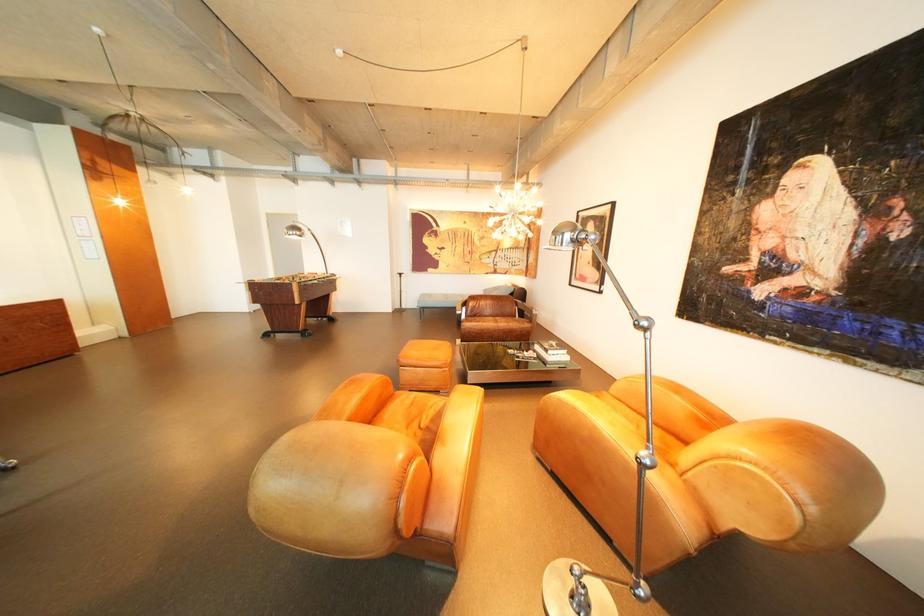
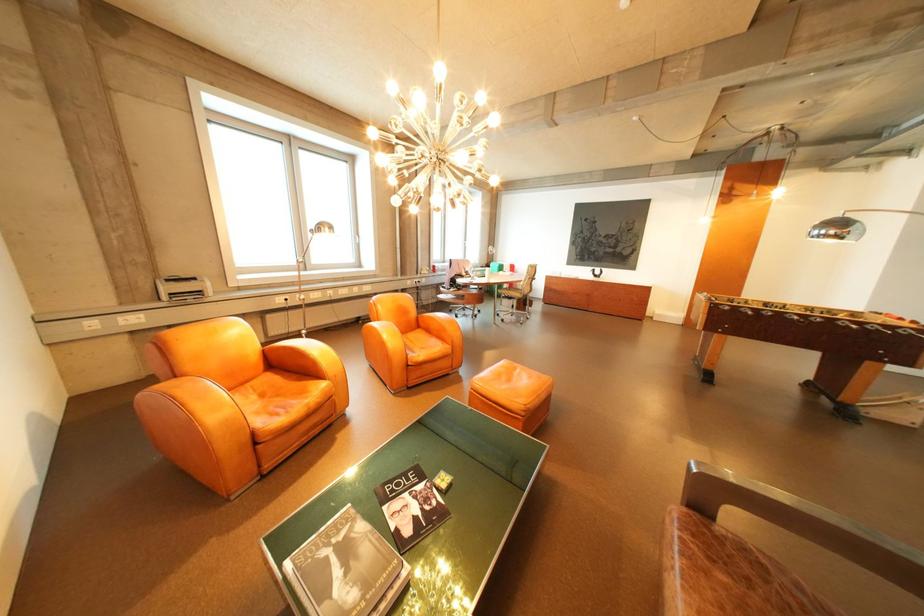
The point at (492,323) is marked in the first image. Where is the corresponding point in the second image?

(696, 554)